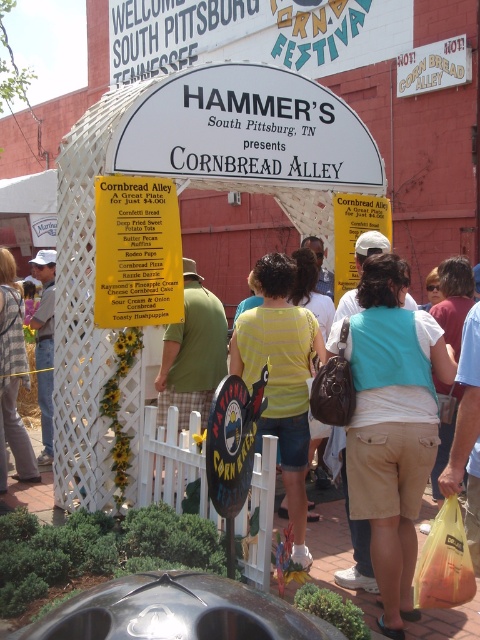
Question: Is yellow paper sign at center behind matte white hat at left?

Choices:
 (A) no
 (B) yes

Answer: (A)

Question: Estimate the real-world distances between objects in this image. Which object is closer to the matte white hat at left?

Choices:
 (A) striped shirt at center
 (B) yellow paper sign at center

Answer: (A)

Question: Does striped shirt at center appear on the right side of matte white hat at left?

Choices:
 (A) no
 (B) yes

Answer: (B)

Question: Which object is farther from the camera taking this photo?

Choices:
 (A) matte white hat at left
 (B) yellow paper sign at center
 (C) striped shirt at center

Answer: (A)

Question: Among these objects, which one is farthest from the camera?

Choices:
 (A) striped shirt at center
 (B) yellow paper sign at center
 (C) matte white hat at left

Answer: (C)

Question: Does yellow paper sign at center lie in front of striped shirt at center?

Choices:
 (A) no
 (B) yes

Answer: (B)